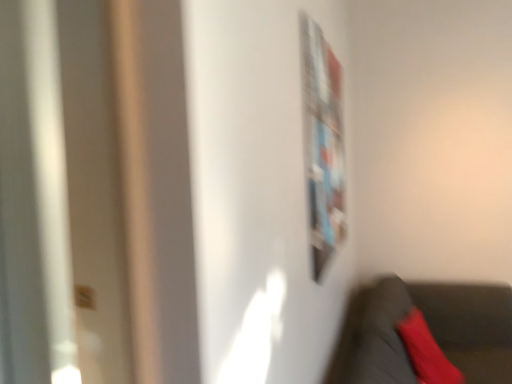
Question: From a real-world perspective, relative to velvet black chair at lower right, is metallic silver bulletin board at upper right vertically above or below?

Choices:
 (A) above
 (B) below

Answer: (A)

Question: Is point (333, 140) closer or farther from the camera than point (361, 324)?

Choices:
 (A) farther
 (B) closer

Answer: (A)

Question: Estimate the real-world distances between objects in this image. Which object is closer to the velvet black chair at lower right?

Choices:
 (A) metallic silver bulletin board at upper right
 (B) velvet red pillow at lower right

Answer: (B)

Question: Which object is the closest to the metallic silver bulletin board at upper right?

Choices:
 (A) velvet black chair at lower right
 (B) velvet red pillow at lower right

Answer: (A)